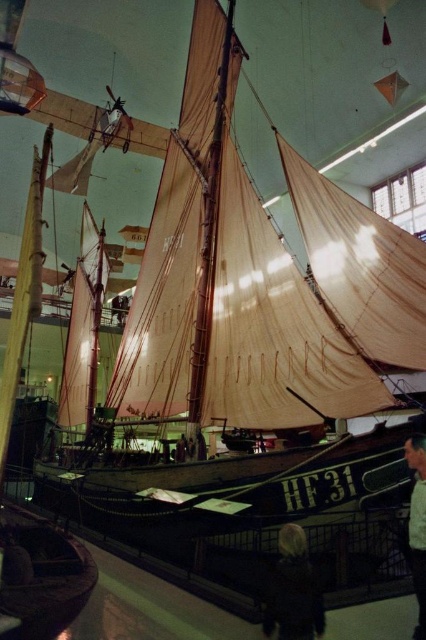
You are a security guard in the museum and need to monitor both the dark hair at lower center and the light brown leather jacket at lower right. Which object is closer to the floor?

The dark hair at lower center is closer to the floor because it is below the light brown leather jacket at lower right.

Looking at this image, you are a security guard in the museum and need to ensure that the dark hair at lower center and the light brown leather jacket at lower right are within the camera view. Which object is wider so that you can adjust the camera angle accordingly?

The dark hair at lower center is wider than the light brown leather jacket at lower right, so you should adjust the camera angle to capture its width properly.